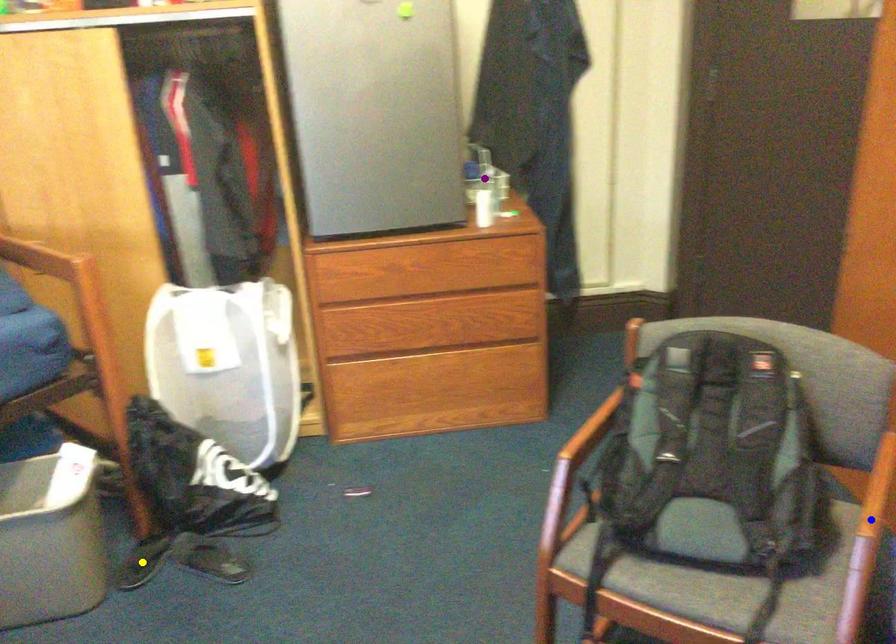
Order these from nearest to farthest:
purple point, blue point, yellow point

purple point < yellow point < blue point